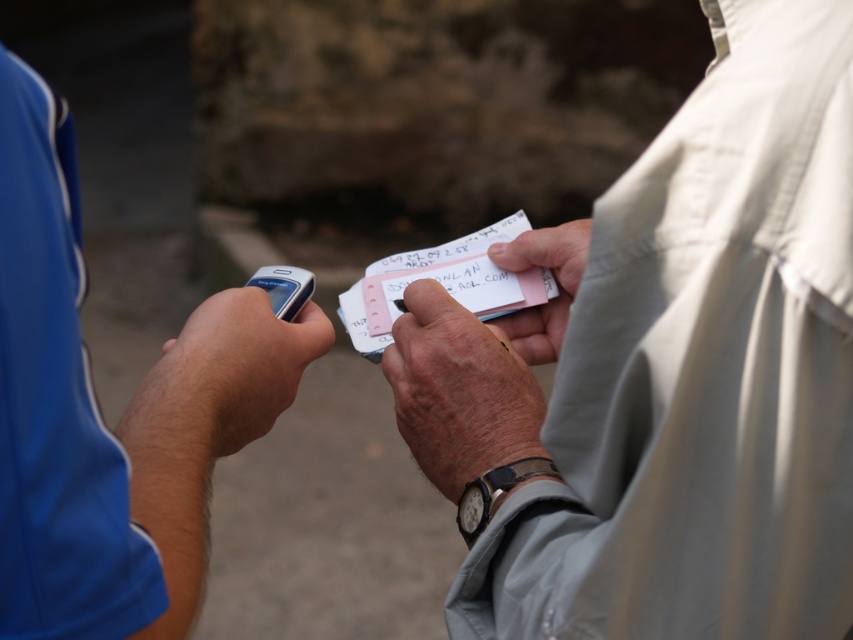
Question: Which point is closer to the camera?

Choices:
 (A) slate gray plastic smartphone at left
 (B) black leather watch at center
 (C) pink paper at center
 (D) pink paper card at center

Answer: (B)

Question: Is pink paper card at center bigger than black leather watch at center?

Choices:
 (A) no
 (B) yes

Answer: (B)

Question: Which of these objects is positioned farthest from the leather wristwatch at center?

Choices:
 (A) matte plastic phone at left
 (B) black leather watch at center
 (C) pink paper at center

Answer: (A)

Question: Is pink paper card at center below black leather watch at center?

Choices:
 (A) yes
 (B) no

Answer: (B)

Question: Which of the following is the closest to the observer?

Choices:
 (A) (177, 355)
 (B) (541, 458)
 (C) (276, 273)
 (D) (468, 276)

Answer: (A)

Question: Can you confirm if matte plastic phone at left is positioned above pink paper card at center?

Choices:
 (A) yes
 (B) no

Answer: (B)